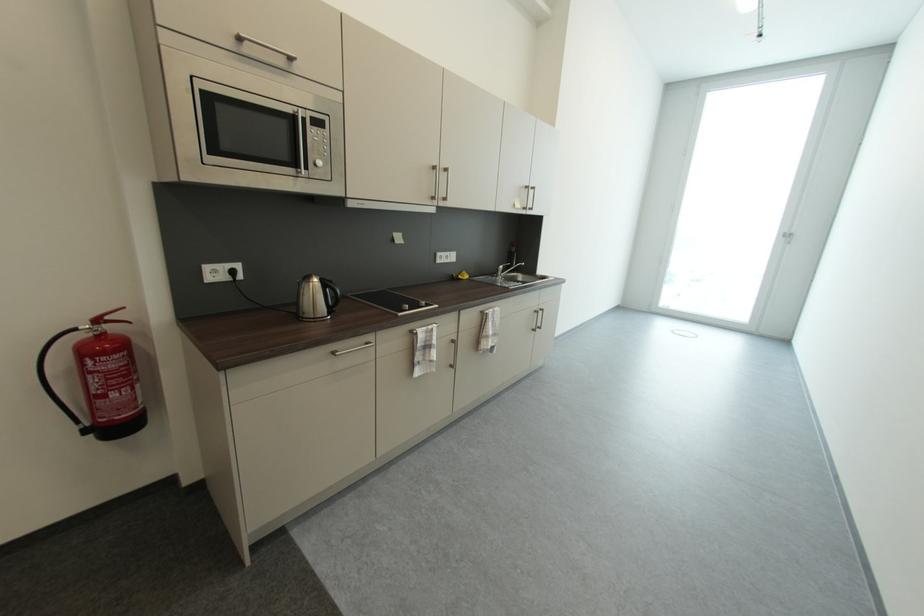
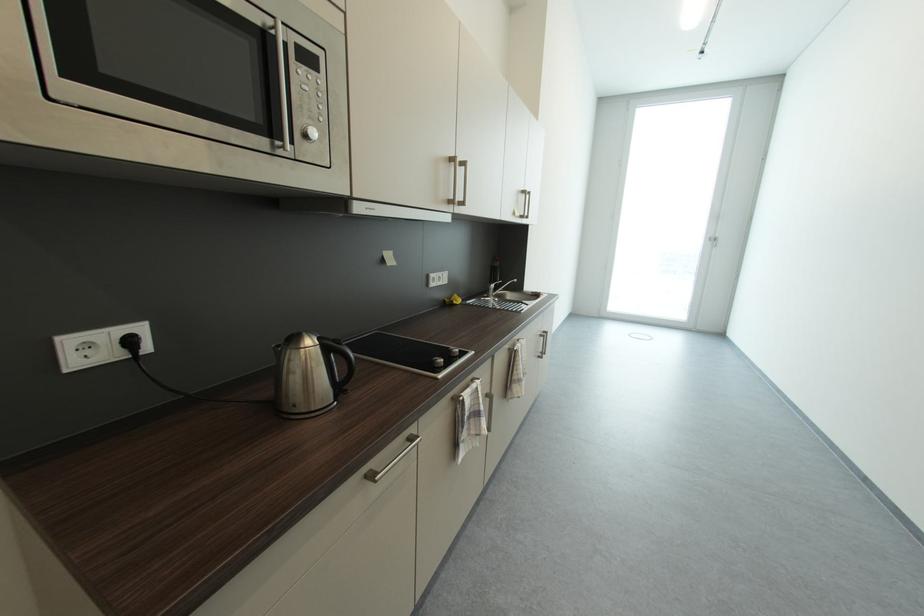
Find the pixel in the second image that matches point (341, 354) in the first image.

(377, 479)